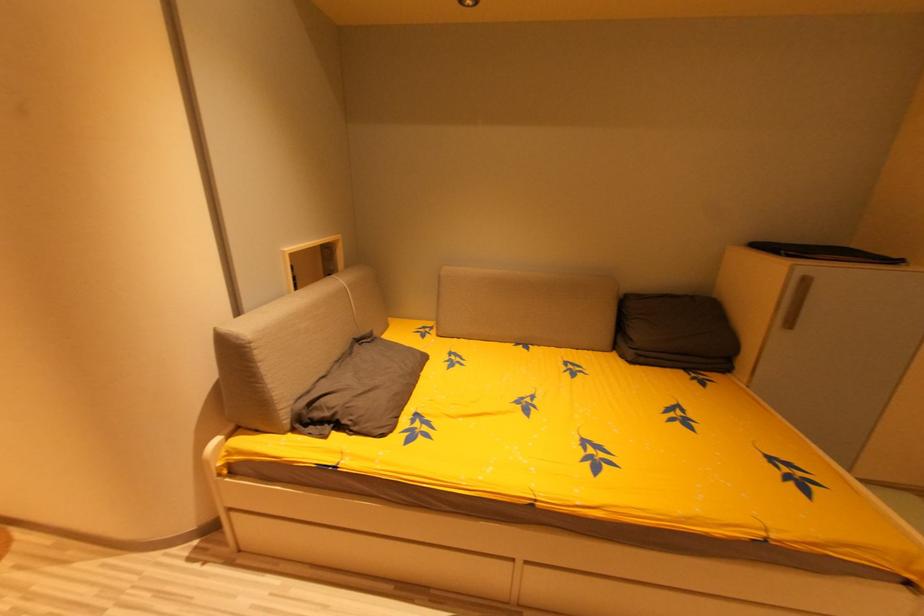
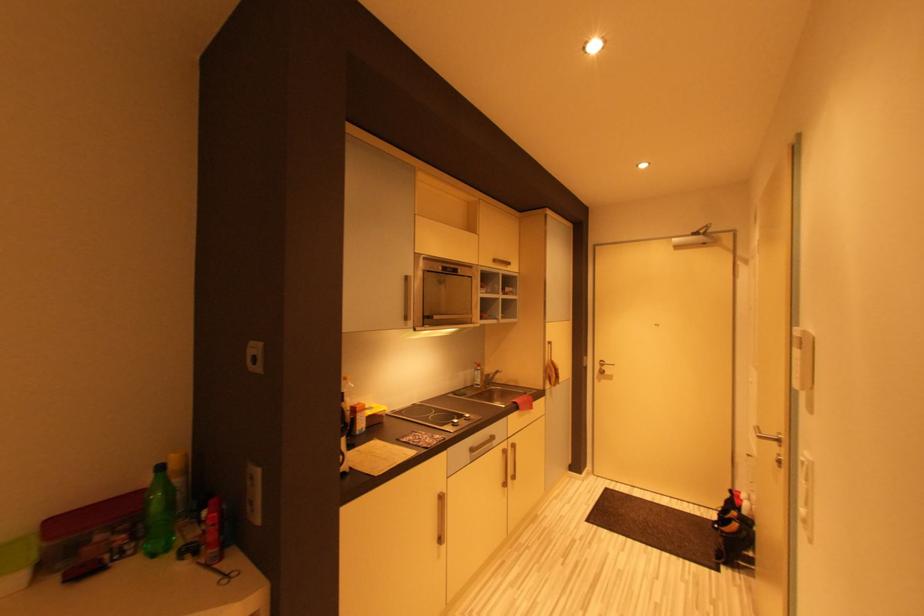
Question: Based on the continuous images, in which direction is the camera rotating? Reply with the corresponding letter.

Choices:
 (A) Left
 (B) Right
 (C) Up
 (D) Down

Answer: (A)